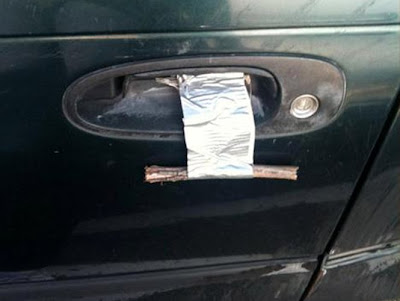
Image resolution: width=400 pixels, height=301 pixels. I want to click on handle, so click(275, 95).